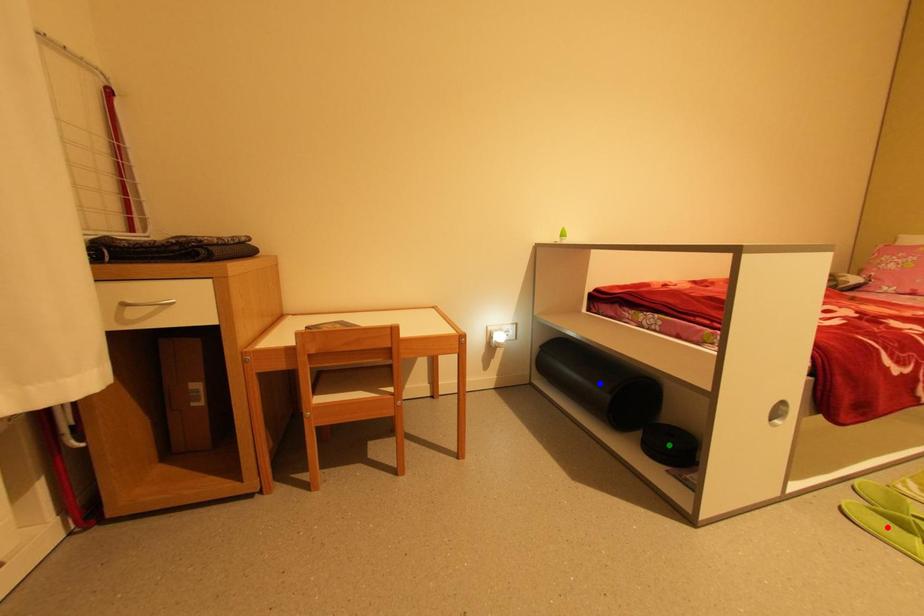
Order these from farthest to nearest:
blue point | green point | red point

blue point, green point, red point